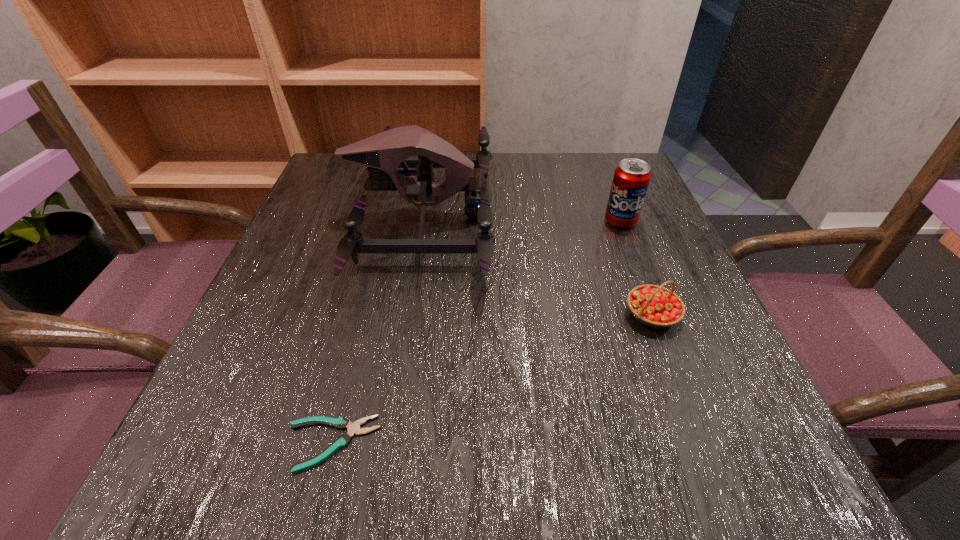
The width and height of the screenshot is (960, 540). What are the coordinates of `object situated at the near edge` in the screenshot? It's located at (342, 441).

Where is `drone present at the left edge`? The height and width of the screenshot is (540, 960). drone present at the left edge is located at coordinates (383, 153).

Locate an element on the screen. The width and height of the screenshot is (960, 540). pliers located at the left edge is located at coordinates (342, 441).

Image resolution: width=960 pixels, height=540 pixels. I want to click on soda can at the right edge, so click(x=631, y=178).

The image size is (960, 540). What are the coordinates of `strawberry that is at the right edge` in the screenshot? It's located at (655, 306).

This screenshot has height=540, width=960. In order to click on object situated at the far left corner in this screenshot , I will do `click(383, 153)`.

You are a GUI agent. You are given a task and a screenshot of the screen. Output one action in this format:
    pyautogui.click(x=<x>, y=<y>)
    Task: Click on the object that is positioned at the near left corner
    The width and height of the screenshot is (960, 540).
    Given the screenshot: What is the action you would take?
    pyautogui.click(x=342, y=441)

The height and width of the screenshot is (540, 960). I want to click on vacant area at the far edge of the desktop, so click(x=502, y=176).

Image resolution: width=960 pixels, height=540 pixels. Identify the location of free space at the near edge of the desktop. (624, 431).

In the image, there is a desktop. Identify the location of free region at the left edge. The width and height of the screenshot is (960, 540). (334, 269).